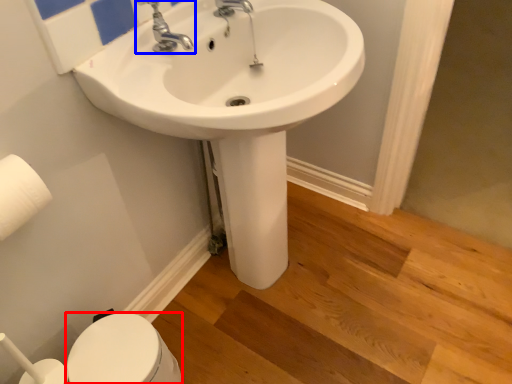
Question: Which of the following is the closest to the observer, bidet (highlighted by a red box) or tap (highlighted by a blue box)?

Choices:
 (A) bidet
 (B) tap

Answer: (B)